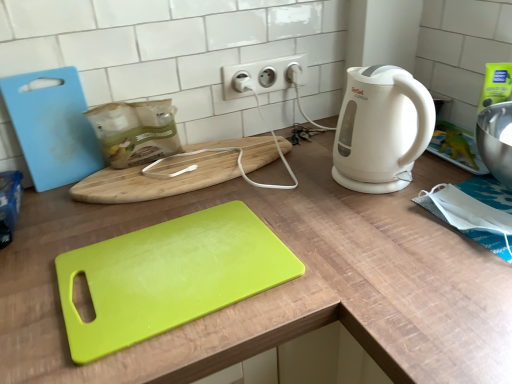
Question: Can you confirm if wooden cutting board at center, marked as the first cutting board in a back-to-front arrangement, is bigger than white plastic electric outlet at upper center?

Choices:
 (A) yes
 (B) no

Answer: (A)

Question: Considering the relative sizes of wooden cutting board at center, marked as the first cutting board in a back-to-front arrangement, and white plastic electric outlet at upper center in the image provided, is wooden cutting board at center, marked as the first cutting board in a back-to-front arrangement, wider than white plastic electric outlet at upper center?

Choices:
 (A) yes
 (B) no

Answer: (A)

Question: From a real-world perspective, is wooden cutting board at center, marked as the first cutting board in a back-to-front arrangement, located beneath white plastic electric outlet at upper center?

Choices:
 (A) no
 (B) yes

Answer: (B)

Question: Is the position of wooden cutting board at center, marked as the first cutting board in a back-to-front arrangement, less distant than that of white plastic electric outlet at upper center?

Choices:
 (A) yes
 (B) no

Answer: (A)

Question: Can you confirm if wooden cutting board at center, marked as the first cutting board in a back-to-front arrangement, is shorter than white plastic electric outlet at upper center?

Choices:
 (A) no
 (B) yes

Answer: (B)

Question: Is wooden cutting board at center, marked as the 3th cutting board in a front-to-back arrangement, to the right of white plastic electric outlet at upper center from the viewer's perspective?

Choices:
 (A) yes
 (B) no

Answer: (B)

Question: Is lime green plastic cutting board at center, which appears as the first cutting board when viewed from the front, positioned before white plastic electric outlet at upper center?

Choices:
 (A) yes
 (B) no

Answer: (A)

Question: Is lime green plastic cutting board at center, which appears as the first cutting board when viewed from the front, outside white plastic electric outlet at upper center?

Choices:
 (A) yes
 (B) no

Answer: (A)

Question: Does lime green plastic cutting board at center, the third cutting board from the back, lie behind white plastic electric outlet at upper center?

Choices:
 (A) no
 (B) yes

Answer: (A)

Question: Does lime green plastic cutting board at center, which appears as the first cutting board when viewed from the front, have a lesser width compared to white plastic electric outlet at upper center?

Choices:
 (A) no
 (B) yes

Answer: (A)

Question: Considering the relative sizes of lime green plastic cutting board at center, the third cutting board from the back, and white plastic electric outlet at upper center in the image provided, is lime green plastic cutting board at center, the third cutting board from the back, smaller than white plastic electric outlet at upper center?

Choices:
 (A) no
 (B) yes

Answer: (A)

Question: Is wooden cutting board at center, marked as the first cutting board in a back-to-front arrangement, completely or partially outside of white matte electric kettle at right?

Choices:
 (A) yes
 (B) no

Answer: (A)